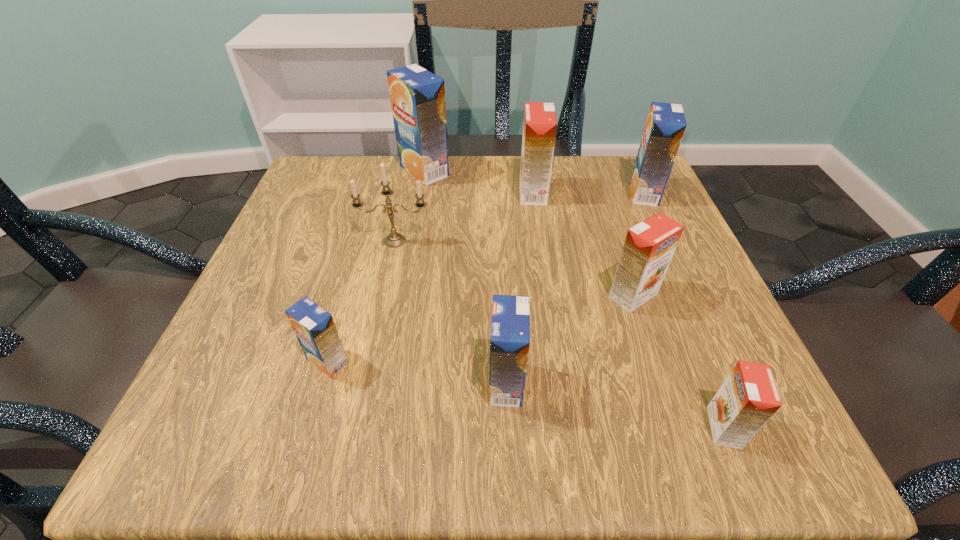
The height and width of the screenshot is (540, 960). What are the coordinates of `vacant space positioned 0.310m on the back of the leftmost orange juice` in the screenshot? It's located at (369, 219).

The width and height of the screenshot is (960, 540). What are the coordinates of `vacant space positioned 0.050m on the back of the smallest orange orange juice` in the screenshot? It's located at (702, 375).

Find the location of `candle at the left edge`. candle at the left edge is located at coordinates (393, 240).

This screenshot has height=540, width=960. What are the coordinates of `orange_juice located in the left edge section of the desktop` in the screenshot? It's located at (314, 327).

Identify the location of object situated at the far right corner. Image resolution: width=960 pixels, height=540 pixels. (665, 125).

This screenshot has width=960, height=540. In order to click on object that is at the near right corner in this screenshot , I will do `click(748, 398)`.

Locate an element on the screen. The image size is (960, 540). vacant point at the far edge is located at coordinates (572, 160).

Image resolution: width=960 pixels, height=540 pixels. In the image, there is a desktop. In order to click on free region at the near edge in this screenshot , I will do `click(514, 416)`.

This screenshot has width=960, height=540. I want to click on vacant space at the left edge of the desktop, so click(x=335, y=286).

You are a GUI agent. You are given a task and a screenshot of the screen. Output one action in this format:
    pyautogui.click(x=<x>, y=<y>)
    Task: Click on the vacant region at the right edge of the desktop
    
    Given the screenshot: What is the action you would take?
    pyautogui.click(x=658, y=339)